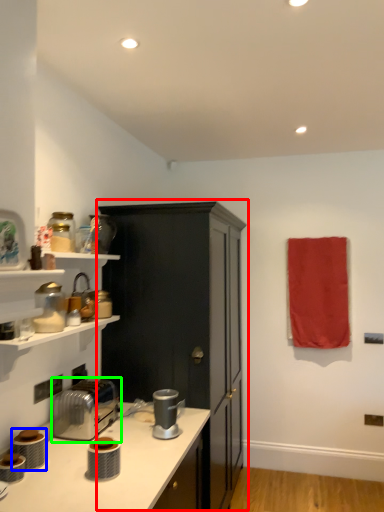
Question: Which object is positioned closest to cabinetry (highlighted by a red box)? Select from appliance (highlighted by a blue box) and toaster (highlighted by a green box).

Choices:
 (A) appliance
 (B) toaster

Answer: (B)